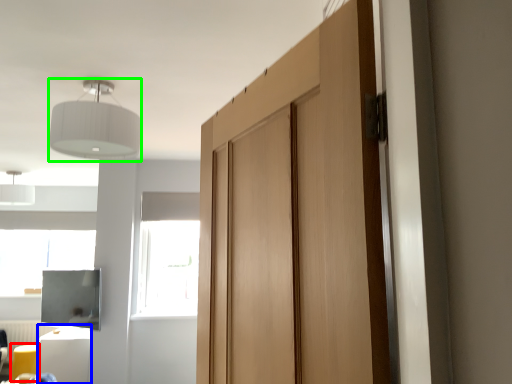
Question: Which object is the closest to the furniture (highlighted by a red box)? Choose among these: furniture (highlighted by a blue box) or light fixture (highlighted by a green box).

Choices:
 (A) furniture
 (B) light fixture

Answer: (A)